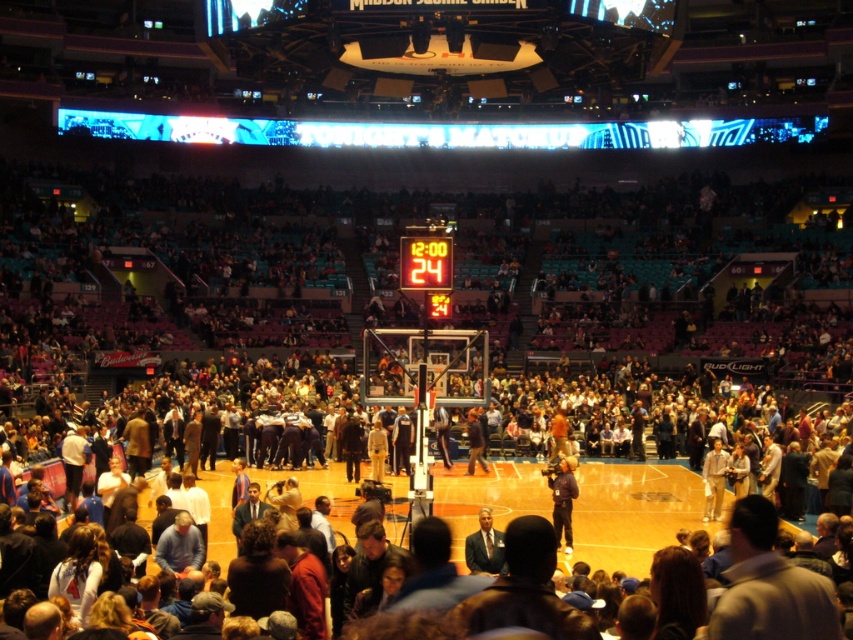
You are a photographer positioned at the back of the arena. You want to take a photo of the orange digital scoreboard at center and the dark blue jacket at center. However, you notice that one of the objects is blocking your view. Which object is blocking the other?

The dark blue jacket at center is behind the orange digital scoreboard at center, so the orange digital scoreboard is blocking the view of the dark blue jacket at center.

You are a spectator sitting in the stands and you want to locate the orange digital scoreboard at center and the dark blue jacket at center. Which one is higher in the basketball arena?

The orange digital scoreboard at center is located above the dark blue jacket at center, so the orange digital scoreboard at center is higher.